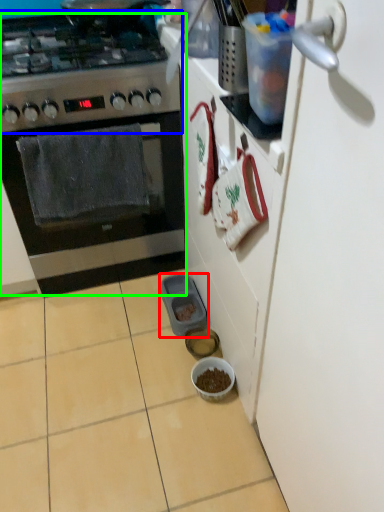
Question: Which object is positioned farthest from appliance (highlighted by a red box)? Select from gas stove (highlighted by a blue box) and kitchen appliance (highlighted by a green box).

Choices:
 (A) gas stove
 (B) kitchen appliance

Answer: (A)